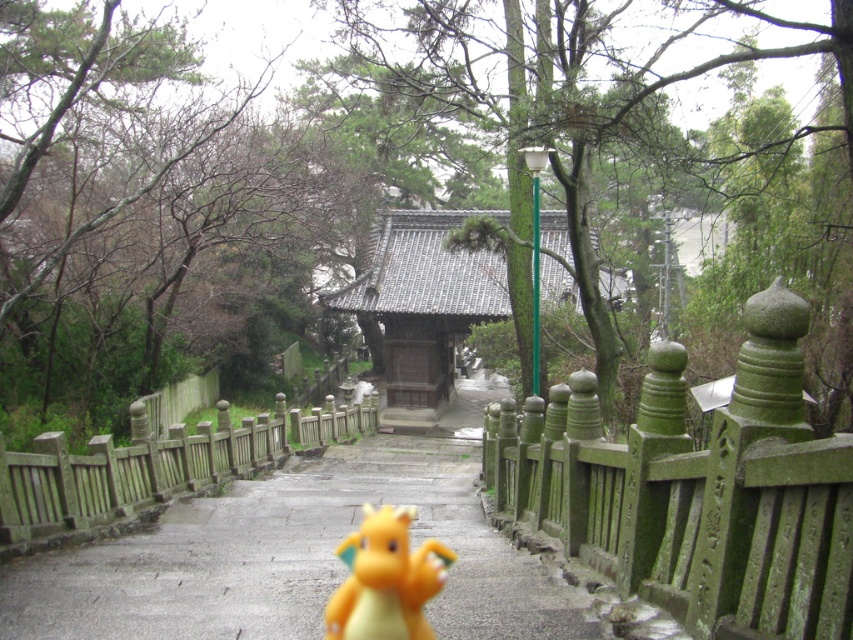
You are standing at the entrance of the temple and want to take a photo of both the green mossy stone fence at right and the green mossy wood fence at left. Which fence should you move closer to in order to capture both in the same frame?

You should move closer to the green mossy wood fence at left because the green mossy stone fence at right is in front of it, so moving closer to the one further back allows both to be in the frame.

From the picture: You are a tourist visiting a Japanese temple and want to take a photo of the yellow rubber dragon at center while also including the green mossy wood fence at left in the frame. Based on their positions, can you tell me if the fence will be on the left or right side of the dragon in your photo?

The green mossy wood fence at left is to the left of the yellow rubber dragon at center, so in your photo, the fence will appear on the left side of the dragon.